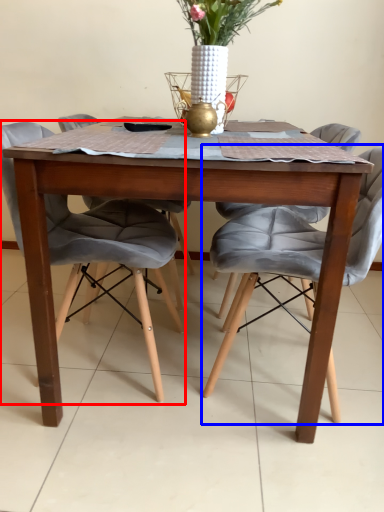
Question: Which object is further to the camera taking this photo, chair (highlighted by a red box) or chair (highlighted by a blue box)?

Choices:
 (A) chair
 (B) chair

Answer: (A)